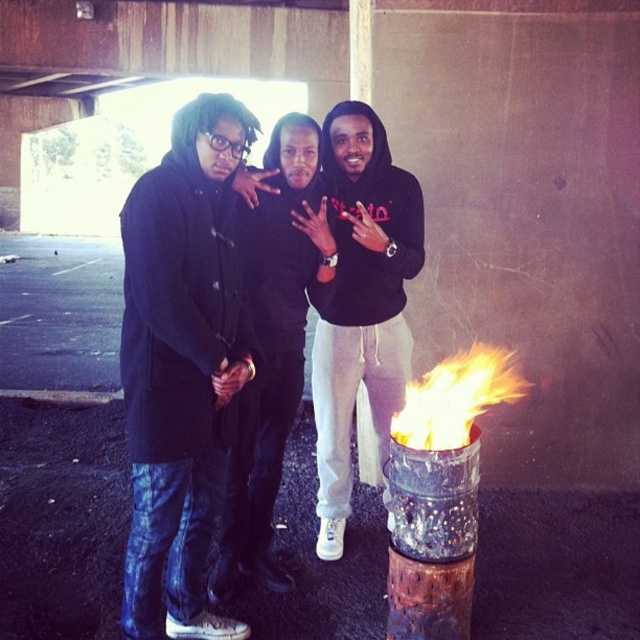
You are a photographer trying to capture a group shot of the denim jacket at left and the black matte hoodie at center. Since you want to ensure both subjects are clearly visible, you need to know their positioning. Based on the scene, which of the two is positioned to the left?

The denim jacket at left is positioned to the left of the black matte hoodie at center, so the denim jacket at left is on the left side.